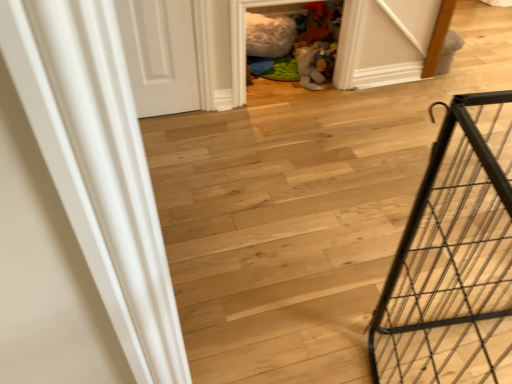
Where is `free location to the right of white matte door at upper left`? Image resolution: width=512 pixels, height=384 pixels. free location to the right of white matte door at upper left is located at coordinates (x=204, y=122).